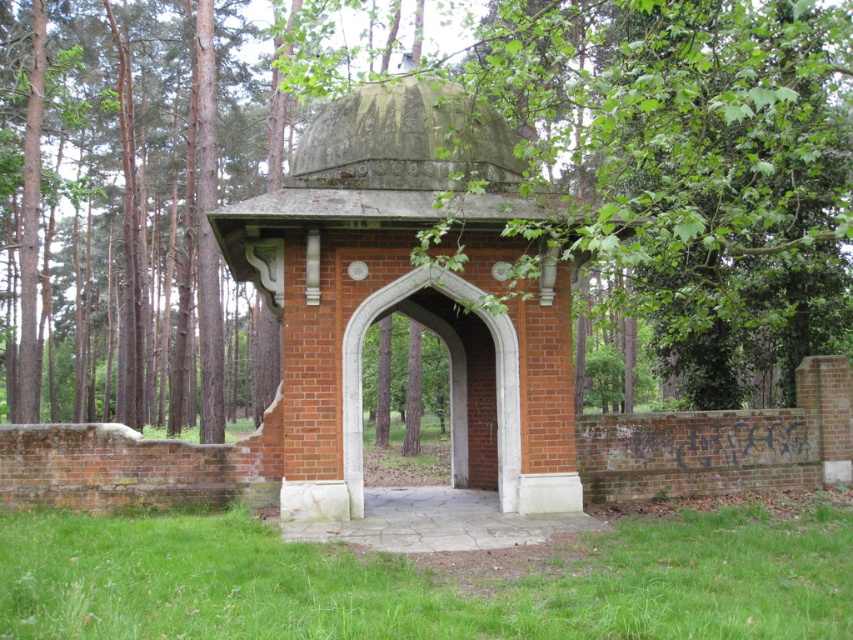
You are standing in front of the pavilion and want to know which object occupies more horizontal space between the green leafy tree at center and the green grass at lower center. Which one is wider?

The green leafy tree at center is wider than the green grass at lower center.

You are a painter wanting to capture the pavilion in your painting. You want to ensure the green leafy tree at center and the red brick gazebo at center are both visible. Which object should you paint first to maintain their proportions correctly?

The green leafy tree at center is larger in size than the red brick gazebo at center, so you should paint the green leafy tree at center first to ensure it is proportionally larger in the painting.